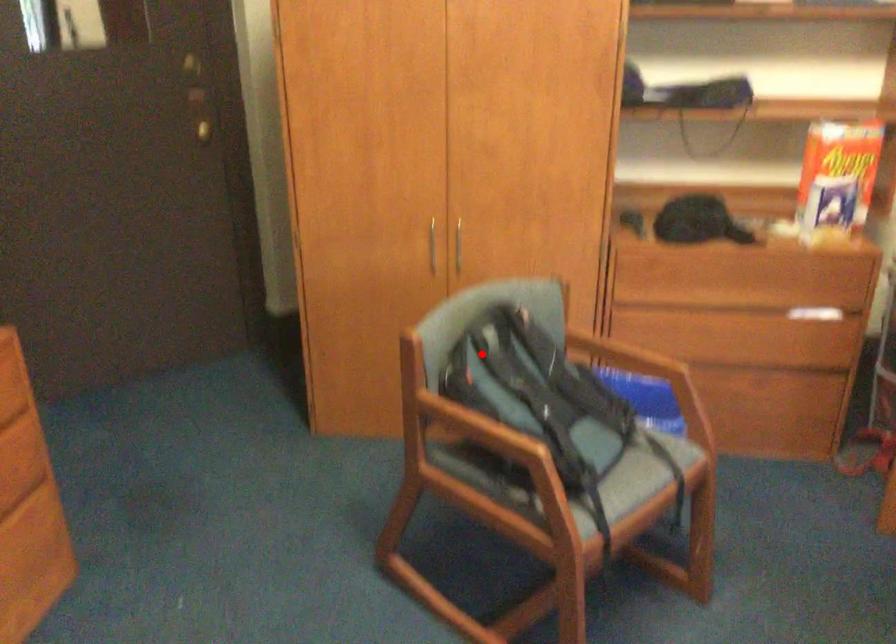
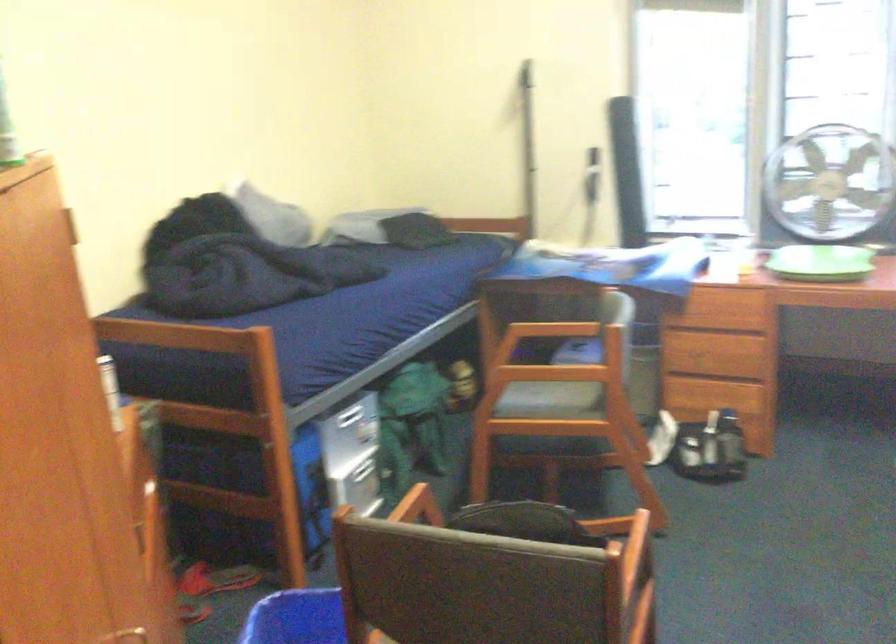
Find the pixel in the second image that matches the highlighted location in the first image.

(528, 523)